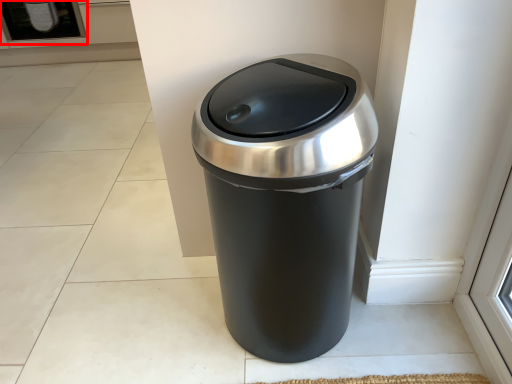
Question: From the image's perspective, considering the relative positions of screen door (annotated by the red box) and waste container in the image provided, where is screen door (annotated by the red box) located with respect to the staircase?

Choices:
 (A) below
 (B) above

Answer: (B)